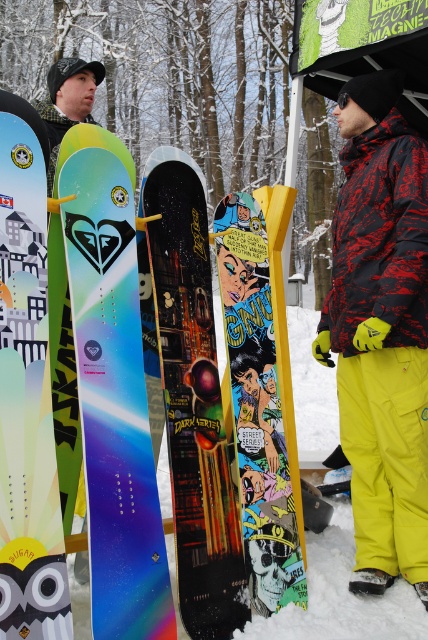
Question: Which of these objects is positioned farthest from the shiny blue snowboard at center?

Choices:
 (A) matte black snowboard at left
 (B) comic book yellow snowboard at center
 (C) dark matte snowboard at center

Answer: (B)

Question: Among these objects, which one is nearest to the camera?

Choices:
 (A) comic book yellow snowboard at center
 (B) matte black snowboard at left
 (C) dark matte snowboard at center

Answer: (B)

Question: Which is nearer to the matte black snowboard at left?

Choices:
 (A) comic book yellow snowboard at center
 (B) shiny blue snowboard at center
 (C) yellow matte snow pants at lower right

Answer: (B)

Question: Does yellow matte snow pants at lower right appear over comic book yellow snowboard at center?

Choices:
 (A) no
 (B) yes

Answer: (B)

Question: Is yellow matte snow pants at lower right thinner than shiny blue snowboard at center?

Choices:
 (A) no
 (B) yes

Answer: (B)

Question: Is shiny blue snowboard at center below dark matte snowboard at center?

Choices:
 (A) yes
 (B) no

Answer: (B)